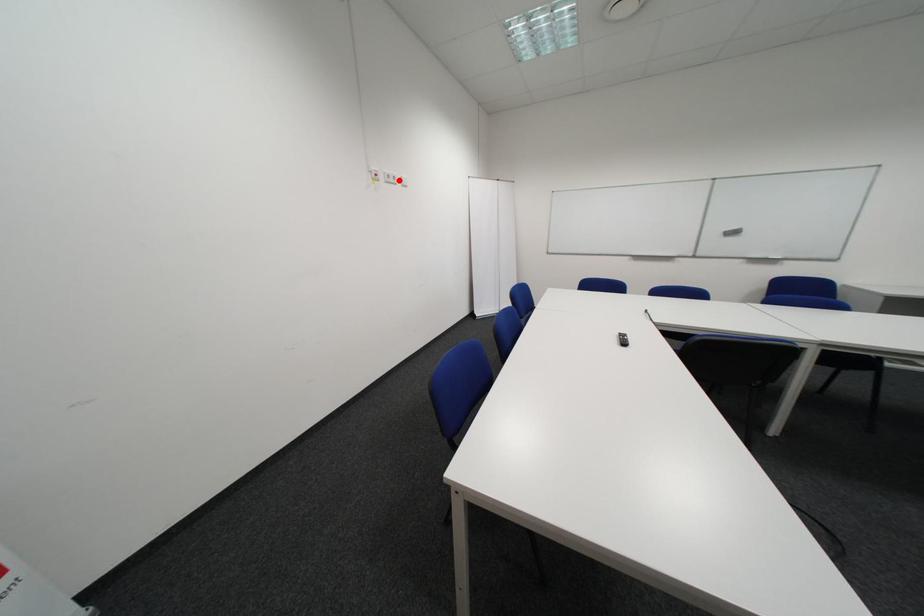
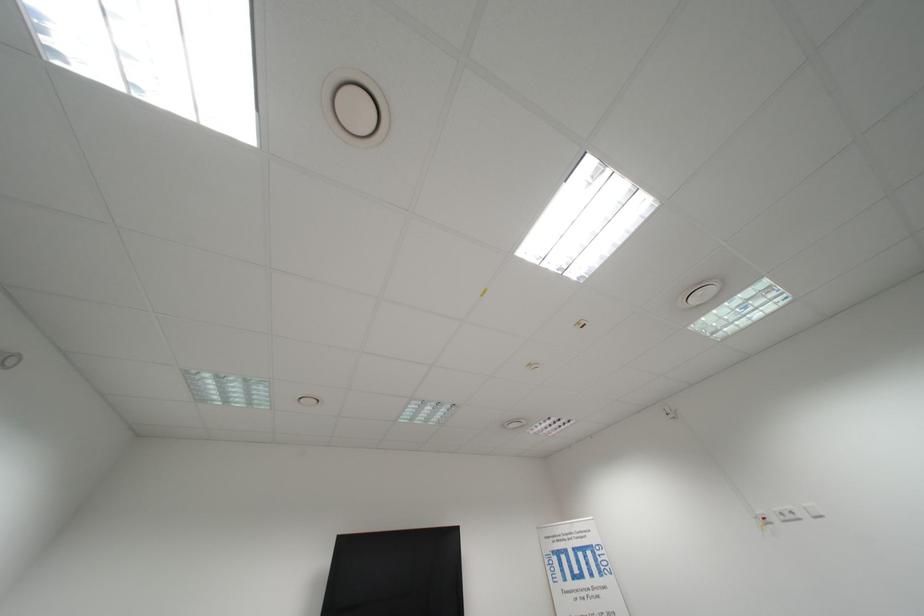
The point at the highlighted location is marked in the first image. Where is the corresponding point in the second image?

(796, 519)